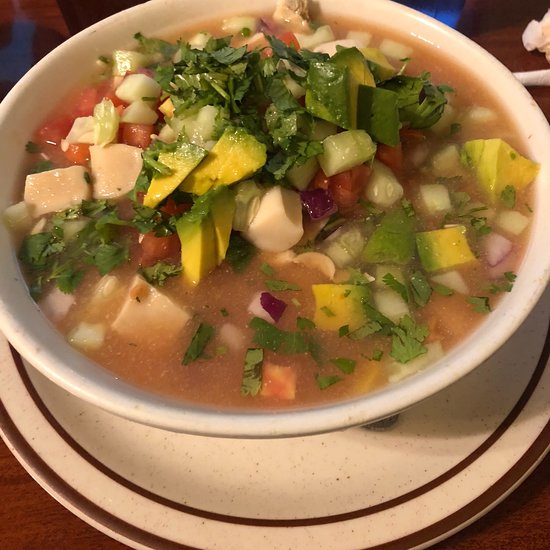
At what (x,y) coordinates should I click in order to perform the action: click on bowl. Please return your answer as a coordinate pair (x, y). This screenshot has height=550, width=550. Looking at the image, I should click on (496, 75).